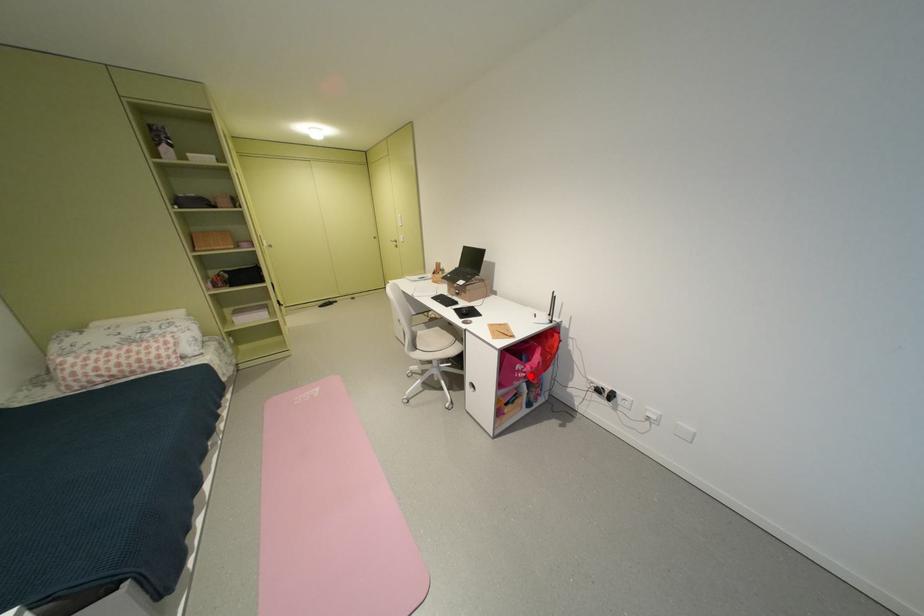
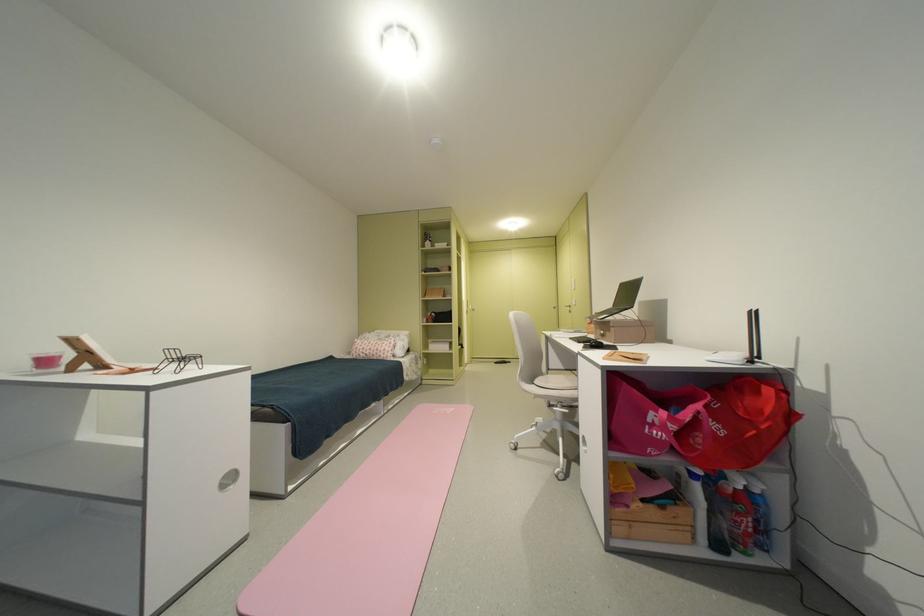
Question: I am providing you with two images of the same scene from different viewpoints. A red point is shown in image1. For the corresponding object point in image2, is it positioned nearer or farther from the camera?

Choices:
 (A) Nearer
 (B) Farther

Answer: (A)